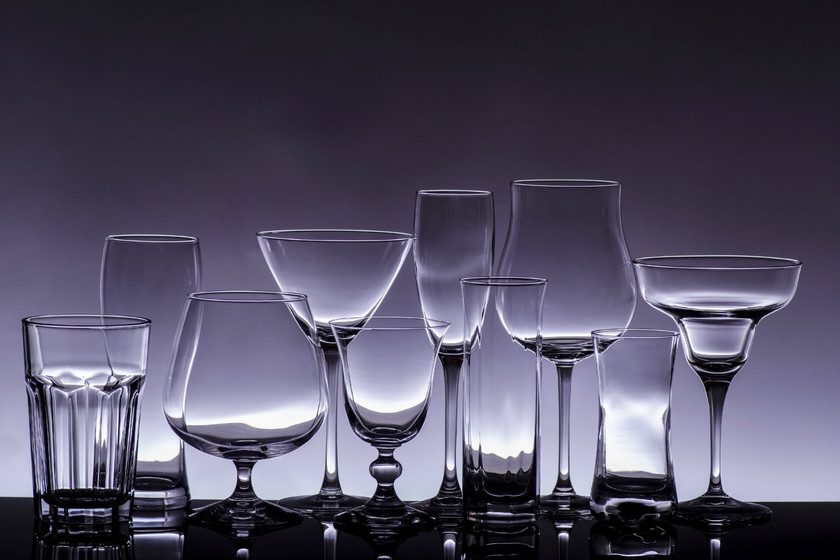
At what (x,y) coordinates should I click in order to perform the action: click on glassware. Please return your answer as a coordinate pair (x, y). Looking at the image, I should click on (75, 378), (165, 244), (244, 361), (334, 267), (384, 366), (431, 263), (492, 338), (589, 251), (628, 380), (689, 328).